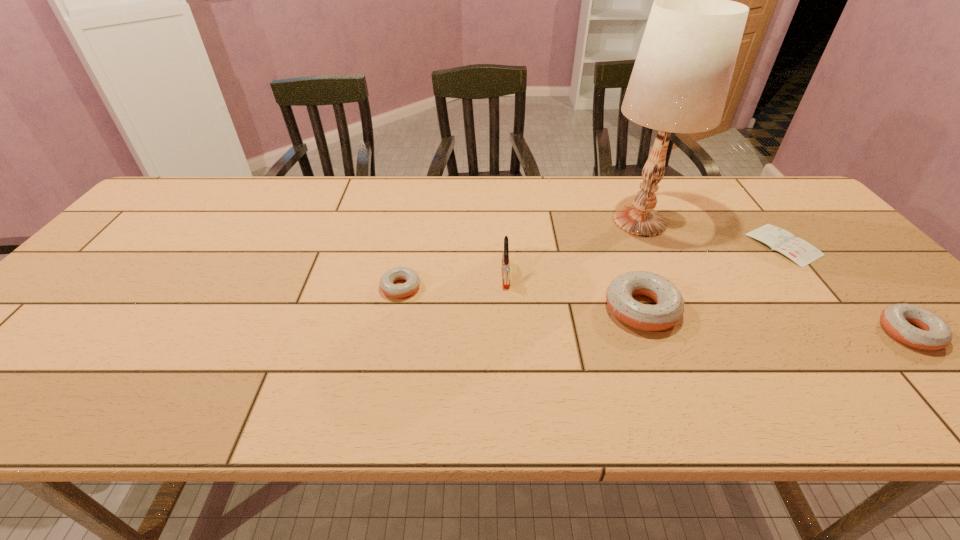
Find the location of a particular element. free space between the second doughnut from right to left and the second tallest object is located at coordinates (573, 291).

Identify the location of free space between the second doughnut from right to left and the fifth tallest object. Image resolution: width=960 pixels, height=540 pixels. (521, 298).

The image size is (960, 540). I want to click on blank region between the second tallest doughnut and the second doughnut from right to left, so click(x=776, y=321).

Locate an element on the screen. Image resolution: width=960 pixels, height=540 pixels. free space that is in between the shortest doughnut and the second tallest object is located at coordinates (453, 280).

Identify the location of vacant point located between the stapler and the diary. click(x=644, y=259).

I want to click on vacant area that lies between the second tallest object and the second tallest doughnut, so click(708, 303).

The width and height of the screenshot is (960, 540). I want to click on the second closest object to the leftmost object, so click(x=669, y=309).

Point out which object is positioned as the second nearest to the fourth tallest object. Please provide its 2D coordinates. Your answer should be formatted as a tuple, i.e. [(x, y)], where the tuple contains the x and y coordinates of a point satisfying the conditions above.

[(681, 77)]

Select which doughnut is the closest to the fifth tallest object. Please provide its 2D coordinates. Your answer should be formatted as a tuple, i.e. [(x, y)], where the tuple contains the x and y coordinates of a point satisfying the conditions above.

[(669, 309)]

Find the location of a particular element. Image resolution: width=960 pixels, height=540 pixels. doughnut object that ranks as the closest to the leftmost object is located at coordinates (669, 309).